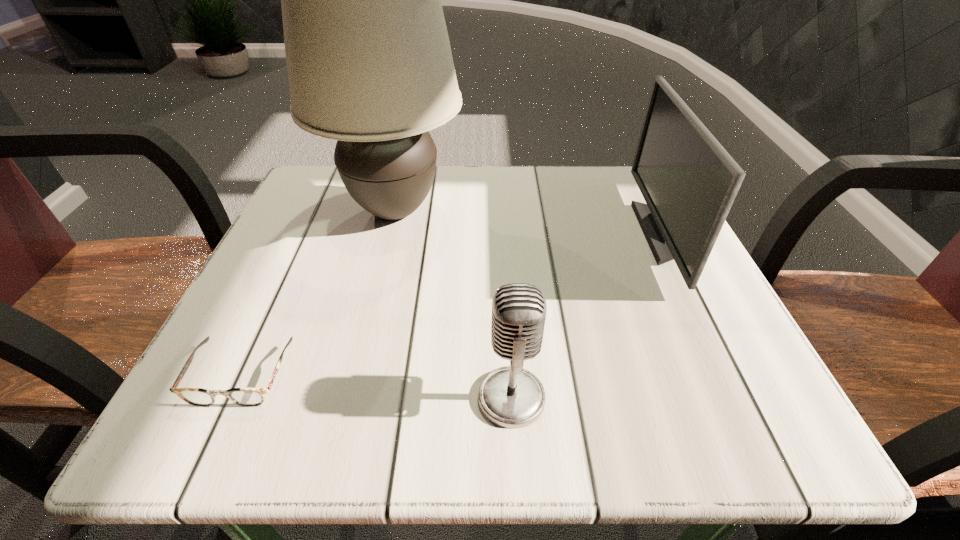
This screenshot has height=540, width=960. In order to click on object positioned at the far right corner in this screenshot , I will do `click(689, 182)`.

Locate an element on the screen. The width and height of the screenshot is (960, 540). free space at the far edge of the desktop is located at coordinates (492, 220).

Image resolution: width=960 pixels, height=540 pixels. Find the location of `free space at the near edge of the desktop`. free space at the near edge of the desktop is located at coordinates (415, 405).

The width and height of the screenshot is (960, 540). I want to click on vacant space at the left edge of the desktop, so click(338, 230).

In the image, there is a desktop. Where is `free space at the right edge`? The width and height of the screenshot is (960, 540). free space at the right edge is located at coordinates (601, 239).

Locate an element on the screen. The image size is (960, 540). blank space at the far left corner is located at coordinates (327, 215).

The height and width of the screenshot is (540, 960). In order to click on vacant space at the near left corner of the desktop in this screenshot , I will do `click(277, 399)`.

Where is `blank region between the shortest object and the second shortest object`? The height and width of the screenshot is (540, 960). blank region between the shortest object and the second shortest object is located at coordinates (376, 387).

At what (x,y) coordinates should I click in order to perform the action: click on vacant area between the monitor and the spectacles. Please return your answer as a coordinate pair (x, y). Image resolution: width=960 pixels, height=540 pixels. Looking at the image, I should click on (452, 304).

Find the location of a particular element. This screenshot has width=960, height=540. free space between the shortest object and the microphone is located at coordinates (376, 387).